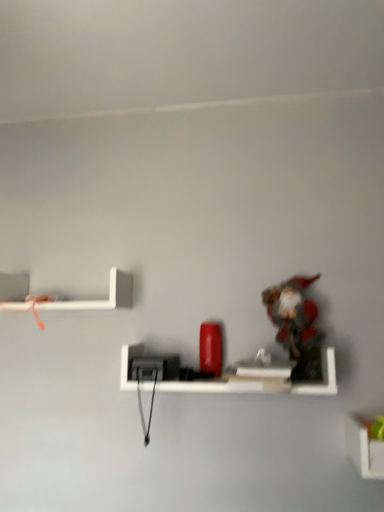
Question: Is matte black shelf at center, which appears as the second shelf when viewed from the top, positioned before white matte shelf at upper left, which is the 3th shelf in right-to-left order?

Choices:
 (A) no
 (B) yes

Answer: (B)

Question: Can you confirm if matte black shelf at center, which appears as the 2th shelf when ordered from the bottom, is taller than white matte shelf at upper left, acting as the 1th shelf starting from the left?

Choices:
 (A) no
 (B) yes

Answer: (A)

Question: Is matte black shelf at center, marked as the second shelf in a right-to-left arrangement, facing away from white matte shelf at upper left, the 3th shelf positioned from the bottom?

Choices:
 (A) no
 (B) yes

Answer: (A)

Question: Is matte black shelf at center, which appears as the 2th shelf when ordered from the bottom, at the left side of white matte shelf at upper left, the 3th shelf positioned from the bottom?

Choices:
 (A) no
 (B) yes

Answer: (A)

Question: From a real-world perspective, is matte black shelf at center, which appears as the second shelf when viewed from the top, located higher than white matte shelf at upper left, the 3th shelf positioned from the bottom?

Choices:
 (A) no
 (B) yes

Answer: (A)

Question: From a real-world perspective, relative to white matte shelf at upper left, the 3th shelf positioned from the bottom, is matte black shelf at center, which appears as the 2th shelf when ordered from the bottom, vertically above or below?

Choices:
 (A) below
 (B) above

Answer: (A)

Question: From the image's perspective, relative to white matte shelf at upper left, positioned as the 1th shelf in top-to-bottom order, is matte black shelf at center, which appears as the 2th shelf when ordered from the bottom, above or below?

Choices:
 (A) below
 (B) above

Answer: (A)

Question: Considering the positions of matte black shelf at center, marked as the second shelf in a right-to-left arrangement, and white matte shelf at upper left, positioned as the 1th shelf in top-to-bottom order, in the image, is matte black shelf at center, marked as the second shelf in a right-to-left arrangement, wider or thinner than white matte shelf at upper left, positioned as the 1th shelf in top-to-bottom order,?

Choices:
 (A) thin
 (B) wide

Answer: (B)

Question: Is matte black shelf at center, which ranks as the second shelf in left-to-right order, inside the boundaries of white matte shelf at upper left, which is the 3th shelf in right-to-left order, or outside?

Choices:
 (A) inside
 (B) outside

Answer: (B)

Question: From a real-world perspective, is white matte shelf at lower right, the first shelf when ordered from right to left, above or below fuzzy fabric toy at right?

Choices:
 (A) above
 (B) below

Answer: (B)

Question: Is point (359, 451) positioned closer to the camera than point (316, 313)?

Choices:
 (A) closer
 (B) farther

Answer: (A)

Question: Is white matte shelf at lower right, which appears as the 3th shelf when viewed from the top, inside the boundaries of fuzzy fabric toy at right, or outside?

Choices:
 (A) inside
 (B) outside

Answer: (B)

Question: Based on their positions, is white matte shelf at lower right, the first shelf when ordered from right to left, located to the left or right of fuzzy fabric toy at right?

Choices:
 (A) left
 (B) right

Answer: (B)

Question: Based on their sizes in the image, would you say white matte shelf at lower right, which appears as the 3th shelf when viewed from the top, is bigger or smaller than matte black shelf at center, which ranks as the second shelf in left-to-right order?

Choices:
 (A) big
 (B) small

Answer: (B)

Question: In the image, is white matte shelf at lower right, which appears as the 3th shelf when viewed from the top, positioned in front of or behind matte black shelf at center, marked as the second shelf in a right-to-left arrangement?

Choices:
 (A) behind
 (B) front

Answer: (B)